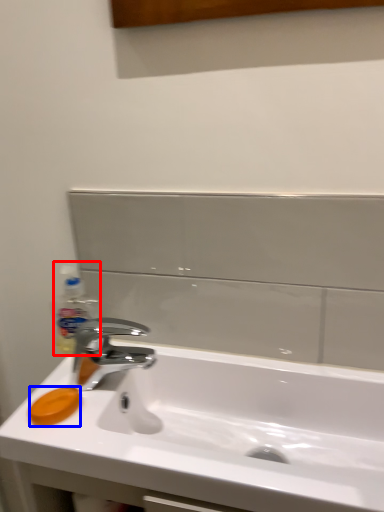
Question: Which of the following is the farthest to the observer, bottle (highlighted by a red box) or soap (highlighted by a blue box)?

Choices:
 (A) bottle
 (B) soap

Answer: (A)